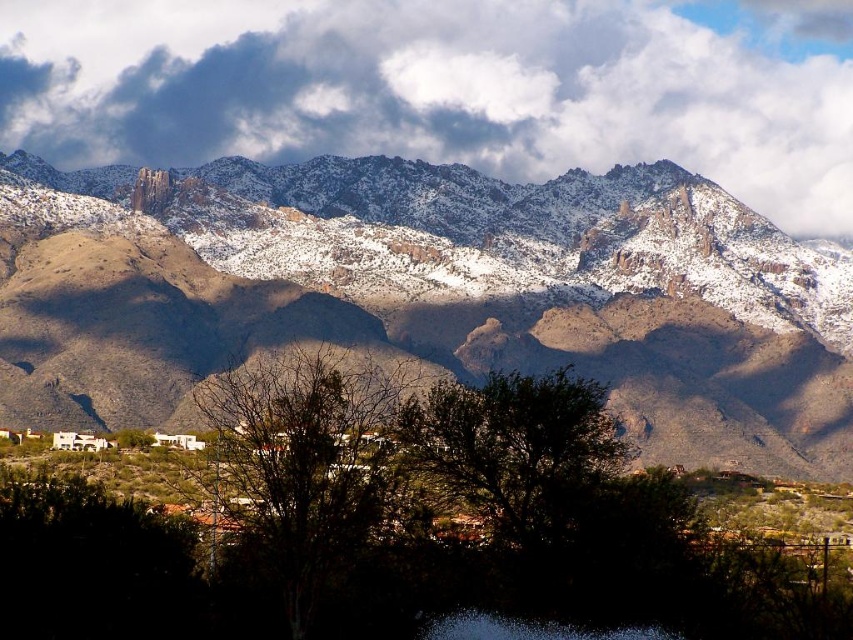
Question: Is snow-covered rock at upper center positioned behind white fluffy cloud at upper center?

Choices:
 (A) no
 (B) yes

Answer: (A)

Question: Which point is closer to the camera?

Choices:
 (A) 811,211
 (B) 583,250

Answer: (B)

Question: Which point is closer to the camera?

Choices:
 (A) (370, 225)
 (B) (111, 141)

Answer: (A)

Question: Is snow-covered rock at upper center in front of white fluffy cloud at upper center?

Choices:
 (A) yes
 (B) no

Answer: (A)

Question: Is snow-covered rock at upper center below white fluffy cloud at upper center?

Choices:
 (A) yes
 (B) no

Answer: (A)